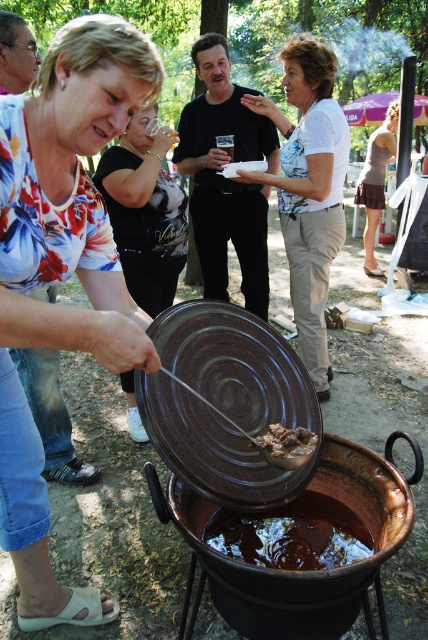
Who is higher up, floral fabric blouse at center or black fabric shirt at upper left?

Positioned higher is black fabric shirt at upper left.

Does floral fabric blouse at center appear under black fabric shirt at upper left?

Answer: Correct, floral fabric blouse at center is located below black fabric shirt at upper left.

Is point (50, 326) farther from camera compared to point (142, 156)?

No, (50, 326) is closer to viewer.

I want to click on floral fabric blouse at center, so click(62, 273).

The image size is (428, 640). I want to click on brown glossy liquid at center, so click(x=291, y=534).

Between point (270, 524) and point (374, 272), which one is positioned behind?

The point (374, 272) is behind.

Where is `brown glossy liquid at center`? The width and height of the screenshot is (428, 640). brown glossy liquid at center is located at coordinates (291, 534).

Is black matte pot at center closer to camera compared to black fabric shirt at upper left?

No, black matte pot at center is behind black fabric shirt at upper left.

Who is more distant from viewer, (270, 168) or (109, 177)?

The point (270, 168) is more distant.

Find the location of a particular element. black matte pot at center is located at coordinates (225, 179).